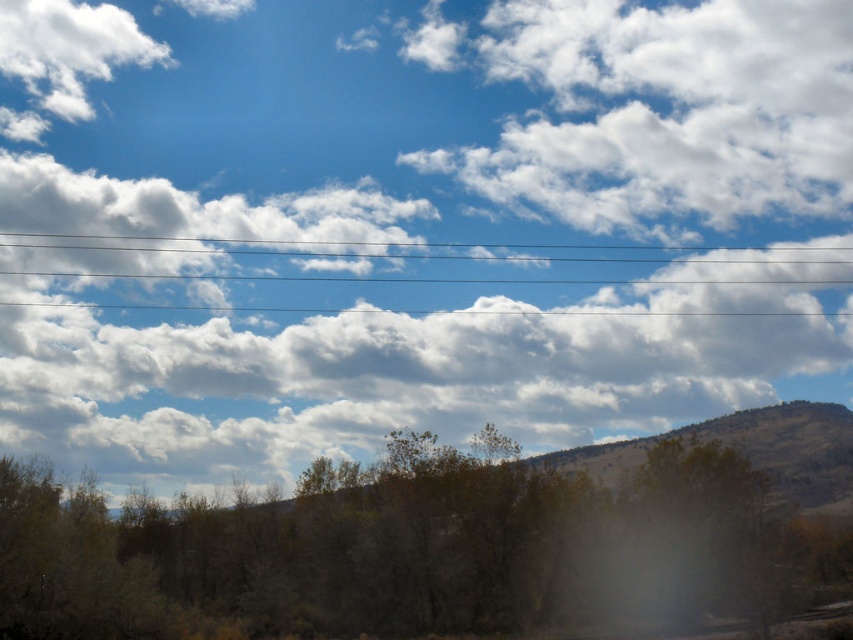
Between point (279, 570) and point (831, 420), which one is positioned behind?

Point (831, 420)

Between brown matte tree at center and brown textured hill at center-right, which one appears on the right side from the viewer's perspective?

brown textured hill at center-right

This screenshot has width=853, height=640. Find the location of `brown matte tree at center`. brown matte tree at center is located at coordinates (415, 554).

I want to click on brown matte tree at center, so click(415, 554).

Can you confirm if brown matte tree at center is wider than clear plastic power lines at upper center?

No.

Where is `brown matte tree at center`? Image resolution: width=853 pixels, height=640 pixels. brown matte tree at center is located at coordinates (415, 554).

This screenshot has width=853, height=640. What do you see at coordinates (415, 554) in the screenshot?
I see `brown matte tree at center` at bounding box center [415, 554].

Locate an element on the screen. brown matte tree at center is located at coordinates (415, 554).

Is brown textured hill at center-right behind clear plastic power lines at upper center?

That is False.

Who is more distant from viewer, (717, 435) or (80, 236)?

Positioned behind is point (80, 236).

Who is more forward, (815, 449) or (100, 248)?

Point (815, 449) is in front.

This screenshot has height=640, width=853. I want to click on brown textured hill at center-right, so click(x=747, y=451).